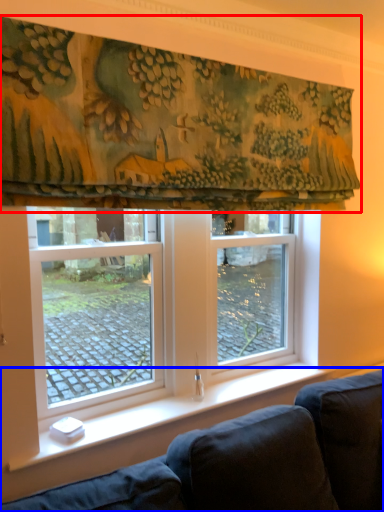
Question: Which point is further to the camera, curtain (highlighted by a red box) or studio couch (highlighted by a blue box)?

Choices:
 (A) curtain
 (B) studio couch

Answer: (B)